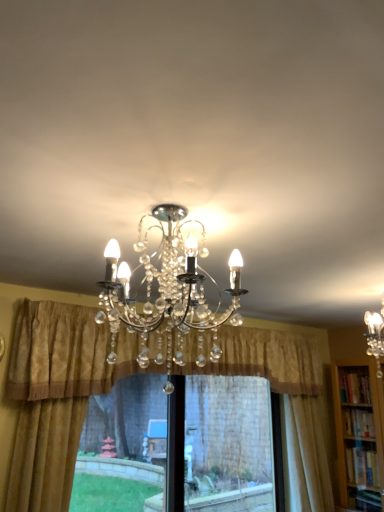
Question: From a real-world perspective, is gold textured curtain at left, marked as the first curtain in a left-to-right arrangement, below clear crystal chandelier at center?

Choices:
 (A) yes
 (B) no

Answer: (A)

Question: Does gold textured curtain at left, marked as the first curtain in a left-to-right arrangement, turn towards clear crystal chandelier at center?

Choices:
 (A) yes
 (B) no

Answer: (A)

Question: Is gold textured curtain at left, marked as the first curtain in a left-to-right arrangement, outside of clear crystal chandelier at center?

Choices:
 (A) yes
 (B) no

Answer: (A)

Question: Is gold textured curtain at left, marked as the first curtain in a left-to-right arrangement, closer to the viewer compared to clear crystal chandelier at center?

Choices:
 (A) no
 (B) yes

Answer: (A)

Question: Is gold textured curtain at left, which is the third curtain from right to left, taller than clear crystal chandelier at center?

Choices:
 (A) no
 (B) yes

Answer: (B)

Question: Considering the positions of clear crystal chandelier at center and gold textured curtain at center, the second curtain viewed from the left, in the image, is clear crystal chandelier at center bigger or smaller than gold textured curtain at center, the second curtain viewed from the left,?

Choices:
 (A) big
 (B) small

Answer: (B)

Question: From the image's perspective, is clear crystal chandelier at center positioned above or below gold textured curtain at center, the second curtain viewed from the left?

Choices:
 (A) below
 (B) above

Answer: (B)

Question: Is clear crystal chandelier at center situated inside gold textured curtain at center, the second curtain viewed from the left, or outside?

Choices:
 (A) inside
 (B) outside

Answer: (B)

Question: Considering their positions, is clear crystal chandelier at center located in front of or behind gold textured curtain at center, the second curtain viewed from the left?

Choices:
 (A) front
 (B) behind

Answer: (A)

Question: From a real-world perspective, relative to transparent plastic window screen at center, is green grass at lower left vertically above or below?

Choices:
 (A) above
 (B) below

Answer: (A)

Question: Is green grass at lower left inside or outside of transparent plastic window screen at center?

Choices:
 (A) outside
 (B) inside

Answer: (A)

Question: Considering the positions of green grass at lower left and transparent plastic window screen at center in the image, is green grass at lower left bigger or smaller than transparent plastic window screen at center?

Choices:
 (A) small
 (B) big

Answer: (A)

Question: In terms of height, does green grass at lower left look taller or shorter compared to transparent plastic window screen at center?

Choices:
 (A) tall
 (B) short

Answer: (B)

Question: Is silky beige curtain at right, the third curtain from the left, to the left or to the right of gold textured curtain at center, which ranks as the second curtain in right-to-left order, in the image?

Choices:
 (A) right
 (B) left

Answer: (A)

Question: Considering the positions of point (306, 461) and point (84, 372), is point (306, 461) closer or farther from the camera than point (84, 372)?

Choices:
 (A) farther
 (B) closer

Answer: (A)